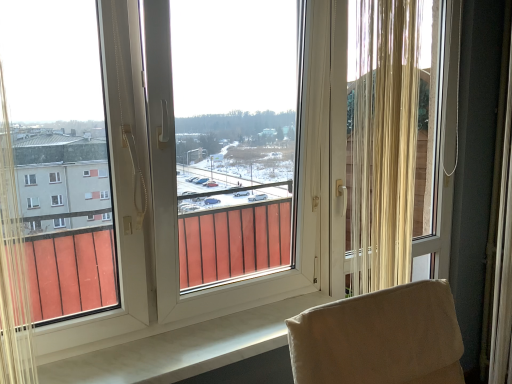
Question: Is beige textured curtain at right wider than transparent plastic window screen at center?

Choices:
 (A) no
 (B) yes

Answer: (A)

Question: From a real-world perspective, is beige textured curtain at right beneath transparent plastic window screen at center?

Choices:
 (A) no
 (B) yes

Answer: (A)

Question: Can you confirm if beige textured curtain at right is bigger than transparent plastic window screen at center?

Choices:
 (A) no
 (B) yes

Answer: (A)

Question: Is beige textured curtain at right taller than transparent plastic window screen at center?

Choices:
 (A) no
 (B) yes

Answer: (A)

Question: Can you confirm if beige textured curtain at right is positioned to the left of transparent plastic window screen at center?

Choices:
 (A) yes
 (B) no

Answer: (B)

Question: Is beige textured curtain at right positioned with its back to transparent plastic window screen at center?

Choices:
 (A) no
 (B) yes

Answer: (B)

Question: Does transparent plastic window screen at center appear on the right side of beige textured curtain at right?

Choices:
 (A) no
 (B) yes

Answer: (A)

Question: Can you confirm if transparent plastic window screen at center is positioned to the left of beige textured curtain at right?

Choices:
 (A) yes
 (B) no

Answer: (A)

Question: Is transparent plastic window screen at center positioned behind beige textured curtain at right?

Choices:
 (A) yes
 (B) no

Answer: (B)

Question: Does transparent plastic window screen at center have a greater width compared to beige textured curtain at right?

Choices:
 (A) no
 (B) yes

Answer: (B)

Question: Does transparent plastic window screen at center have a lesser height compared to beige textured curtain at right?

Choices:
 (A) no
 (B) yes

Answer: (A)

Question: Is transparent plastic window screen at center aimed at beige textured curtain at right?

Choices:
 (A) no
 (B) yes

Answer: (B)

Question: In terms of height, does transparent plastic window screen at center look taller or shorter compared to beige textured curtain at right?

Choices:
 (A) short
 (B) tall

Answer: (B)